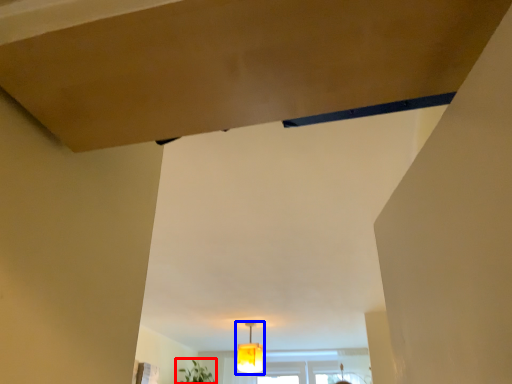
Question: Which point is closer to the camera, plant (highlighted by a red box) or lamp (highlighted by a blue box)?

Choices:
 (A) plant
 (B) lamp

Answer: (B)